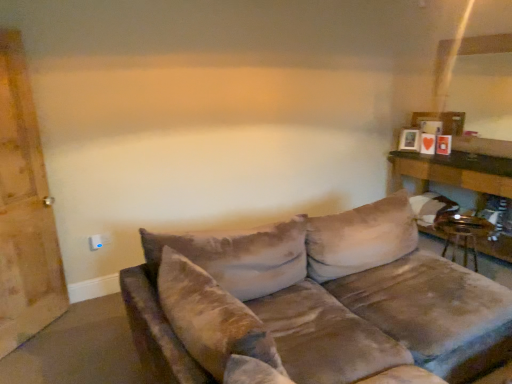
Question: From a real-world perspective, is white plastic electric outlet at lower left located beneath wooden table at right?

Choices:
 (A) yes
 (B) no

Answer: (B)

Question: Is white plastic electric outlet at lower left beside wooden table at right?

Choices:
 (A) yes
 (B) no

Answer: (B)

Question: Does white plastic electric outlet at lower left come in front of wooden table at right?

Choices:
 (A) no
 (B) yes

Answer: (A)

Question: Is white plastic electric outlet at lower left smaller than wooden table at right?

Choices:
 (A) yes
 (B) no

Answer: (A)

Question: Can you confirm if white plastic electric outlet at lower left is taller than wooden table at right?

Choices:
 (A) no
 (B) yes

Answer: (A)

Question: From their relative heights in the image, would you say white plastic electric outlet at lower left is taller or shorter than velvet brown couch at center?

Choices:
 (A) short
 (B) tall

Answer: (A)

Question: From the image's perspective, is white plastic electric outlet at lower left above or below velvet brown couch at center?

Choices:
 (A) below
 (B) above

Answer: (B)

Question: Is point (100, 244) closer or farther from the camera than point (291, 241)?

Choices:
 (A) closer
 (B) farther

Answer: (B)

Question: In the image, is white plastic electric outlet at lower left on the left side or the right side of velvet brown couch at center?

Choices:
 (A) left
 (B) right

Answer: (A)

Question: Based on their sizes in the image, would you say wooden barn door at left is bigger or smaller than matte wooden picture frame at upper right?

Choices:
 (A) small
 (B) big

Answer: (B)

Question: In the image, is wooden barn door at left on the left side or the right side of matte wooden picture frame at upper right?

Choices:
 (A) left
 (B) right

Answer: (A)

Question: From a real-world perspective, is wooden barn door at left positioned above or below matte wooden picture frame at upper right?

Choices:
 (A) below
 (B) above

Answer: (B)

Question: Considering the positions of wooden barn door at left and matte wooden picture frame at upper right in the image, is wooden barn door at left wider or thinner than matte wooden picture frame at upper right?

Choices:
 (A) wide
 (B) thin

Answer: (B)

Question: Is point (414, 150) positioned closer to the camera than point (94, 248)?

Choices:
 (A) closer
 (B) farther

Answer: (B)

Question: From a real-world perspective, is matte wooden picture frame at upper right physically located above or below white plastic electric outlet at lower left?

Choices:
 (A) above
 (B) below

Answer: (A)